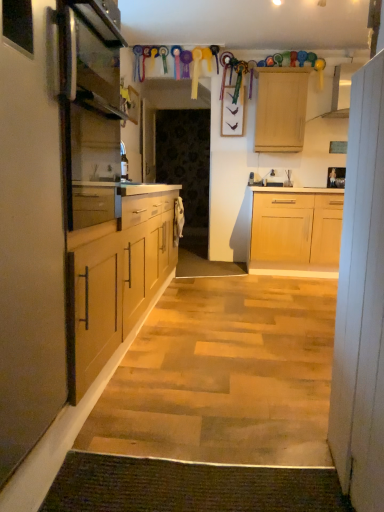
Question: Is satin silver oven at left in front of wooden picture frame at upper right?

Choices:
 (A) no
 (B) yes

Answer: (B)

Question: From the image's perspective, does satin silver oven at left appear higher than wooden picture frame at upper right?

Choices:
 (A) no
 (B) yes

Answer: (A)

Question: Can you confirm if satin silver oven at left is wider than wooden picture frame at upper right?

Choices:
 (A) yes
 (B) no

Answer: (A)

Question: Is the surface of satin silver oven at left in direct contact with wooden picture frame at upper right?

Choices:
 (A) yes
 (B) no

Answer: (B)

Question: Is satin silver oven at left at the right side of wooden picture frame at upper right?

Choices:
 (A) no
 (B) yes

Answer: (A)

Question: Is white matte cabinet at left, acting as the first cabinet starting from the left, in front of or behind satin silver oven at left in the image?

Choices:
 (A) behind
 (B) front

Answer: (B)

Question: Considering the relative positions of white matte cabinet at left, which appears as the 2th cabinet when viewed from the right, and satin silver oven at left in the image provided, is white matte cabinet at left, which appears as the 2th cabinet when viewed from the right, to the left or to the right of satin silver oven at left?

Choices:
 (A) left
 (B) right

Answer: (A)

Question: From the image's perspective, is white matte cabinet at left, which appears as the 2th cabinet when viewed from the right, located above or below satin silver oven at left?

Choices:
 (A) above
 (B) below

Answer: (B)

Question: Is white matte cabinet at left, acting as the first cabinet starting from the left, spatially inside satin silver oven at left, or outside of it?

Choices:
 (A) inside
 (B) outside

Answer: (B)

Question: From a real-world perspective, is green textured mat at lower center positioned above or below satin silver oven at left?

Choices:
 (A) above
 (B) below

Answer: (B)

Question: Which is correct: green textured mat at lower center is inside satin silver oven at left, or outside of it?

Choices:
 (A) outside
 (B) inside

Answer: (A)

Question: Considering their positions, is green textured mat at lower center located in front of or behind satin silver oven at left?

Choices:
 (A) front
 (B) behind

Answer: (A)

Question: In terms of width, does green textured mat at lower center look wider or thinner when compared to satin silver oven at left?

Choices:
 (A) wide
 (B) thin

Answer: (B)

Question: Is point (370, 342) positioned closer to the camera than point (77, 95)?

Choices:
 (A) farther
 (B) closer

Answer: (B)

Question: From a real-world perspective, is white wood cabinet at right, the first cabinet in the right-to-left sequence, above or below satin silver oven at left?

Choices:
 (A) above
 (B) below

Answer: (B)